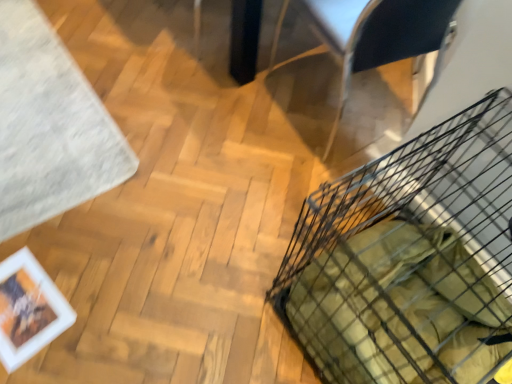
Find the location of a particular element. The height and width of the screenshot is (384, 512). free region under white soft rug at upper left (from a real-world perspective) is located at coordinates [36, 104].